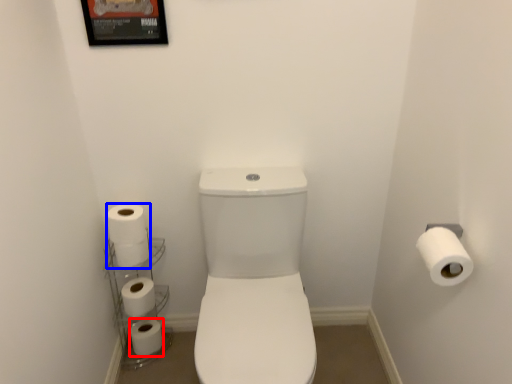
Question: Which of the following is the farthest to the observer, toilet paper (highlighted by a red box) or toilet paper (highlighted by a blue box)?

Choices:
 (A) toilet paper
 (B) toilet paper

Answer: (A)